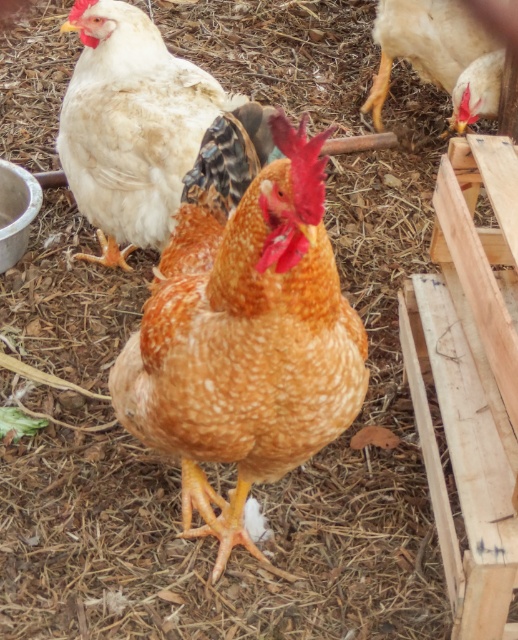
Is the position of white fluffy chicken at upper left more distant than that of matte white chicken at upper right?

No, it is not.

Is point (137, 108) farther from camera compared to point (420, 12)?

No, (137, 108) is closer to viewer.

Describe the element at coordinates (136, 125) in the screenshot. I see `white fluffy chicken at upper left` at that location.

The image size is (518, 640). I want to click on white fluffy chicken at upper left, so click(x=136, y=125).

Between speckled feathered chicken at center and white fluffy chicken at upper left, which one is positioned higher?

white fluffy chicken at upper left

From the picture: Which is below, speckled feathered chicken at center or white fluffy chicken at upper left?

Positioned lower is speckled feathered chicken at center.

Who is more forward, (136, 394) or (121, 166)?

Positioned in front is point (136, 394).

The width and height of the screenshot is (518, 640). Identify the location of speckled feathered chicken at center. (244, 333).

Who is higher up, speckled feathered chicken at center or matte white chicken at upper right?

Positioned higher is matte white chicken at upper right.

Is point (263, 234) in front of point (407, 26)?

That is True.

Is point (198, 451) less distant than point (449, 60)?

Yes.

Identify the location of speckled feathered chicken at center. tap(244, 333).